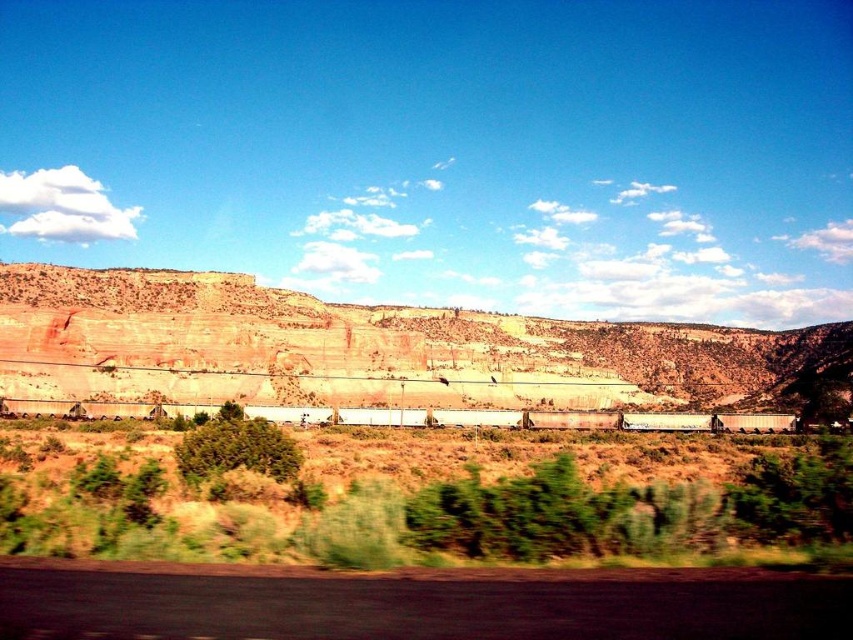
Question: Observing the image, what is the correct spatial positioning of brown grassland at center in reference to rustic stone cliff at center?

Choices:
 (A) right
 (B) left

Answer: (B)

Question: Can you confirm if brown grassland at center is positioned to the right of rustic stone cliff at center?

Choices:
 (A) no
 (B) yes

Answer: (A)

Question: Which point appears farthest from the camera in this image?

Choices:
 (A) (839, 518)
 (B) (347, 328)

Answer: (B)

Question: Among these objects, which one is farthest from the camera?

Choices:
 (A) brown grassland at center
 (B) rustic stone cliff at center

Answer: (B)

Question: Is brown grassland at center closer to the viewer compared to rustic stone cliff at center?

Choices:
 (A) yes
 (B) no

Answer: (A)

Question: Which point is farther from the camera taking this photo?

Choices:
 (A) (264, 348)
 (B) (74, 435)

Answer: (A)